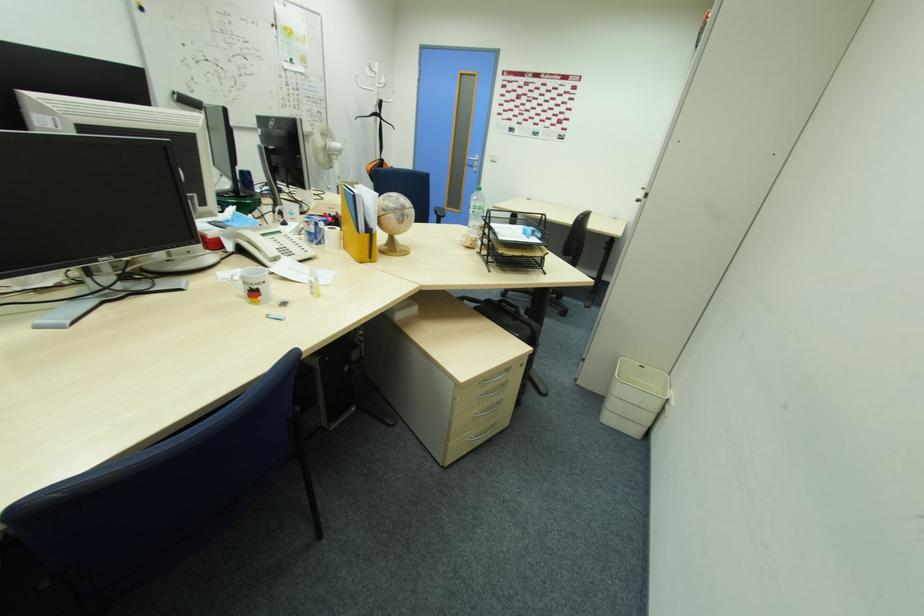
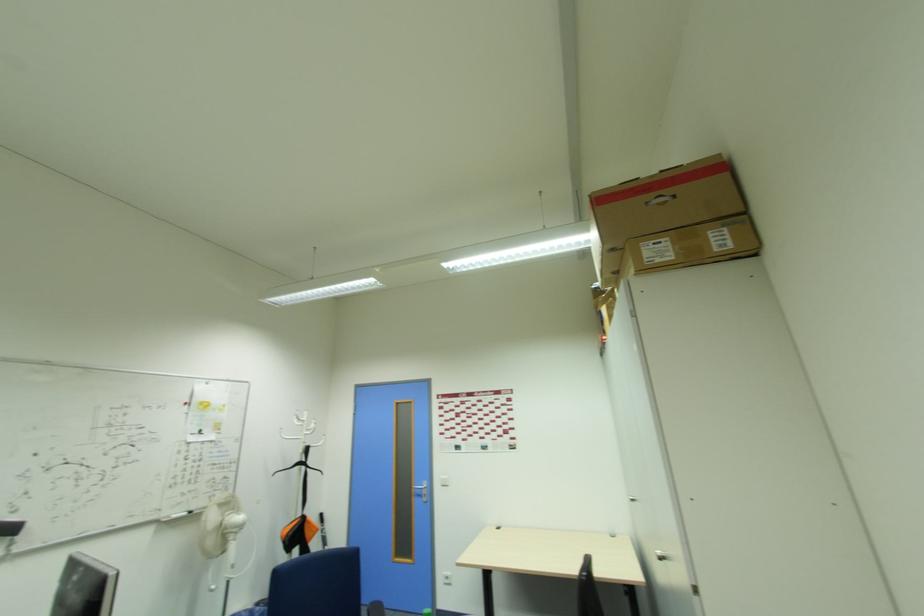
How did the camera likely rotate?

The camera's rotation is toward right-up.